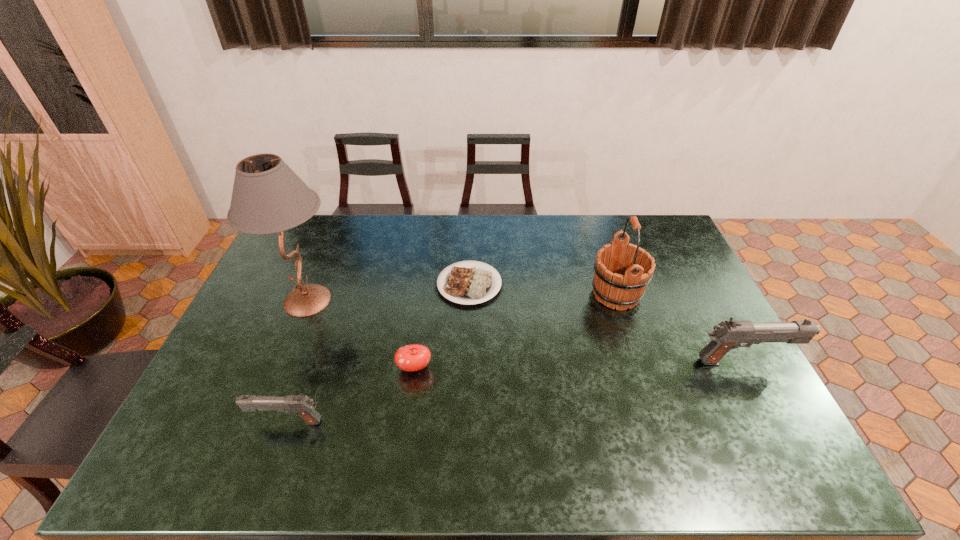
If the aim is uniform spacing by inserting an additional gun among them, please point to a vacant space for this new gun. Please provide its 2D coordinates. Your answer should be formatted as a tuple, i.e. [(x, y)], where the tuple contains the x and y coordinates of a point satisfying the conditions above.

[(529, 390)]